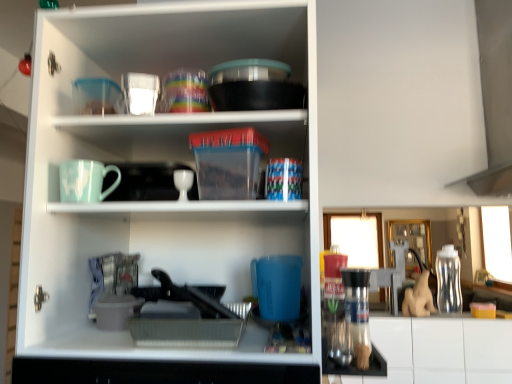
Question: From a real-world perspective, relative to translucent plastic cups at upper center, which appears as the 1th tableware when viewed from the top, is matte ceramic mug at upper left vertically above or below?

Choices:
 (A) below
 (B) above

Answer: (A)

Question: Visually, is matte ceramic mug at upper left positioned to the left or to the right of translucent plastic cups at upper center, the 3th tableware ordered from the bottom?

Choices:
 (A) left
 (B) right

Answer: (A)

Question: Which is nearer to the transparent plastic bottle at right?

Choices:
 (A) gray plastic tray at lower center
 (B) white glossy egg cup at center, which is the 3th tableware from top to bottom
 (C) transparent glass cup at upper center, acting as the 2th tableware starting from the top
 (D) translucent plastic cups at upper center, which appears as the 1th tableware when viewed from the top
 (E) matte ceramic mug at upper left

Answer: (A)

Question: Based on their relative distances, which object is farther from the transparent plastic bottle at right?

Choices:
 (A) matte ceramic mug at upper left
 (B) white glossy egg cup at center, arranged as the 1th tableware when ordered from the bottom
 (C) gray plastic tray at lower center
 (D) transparent glass cup at upper center, acting as the 2th tableware starting from the top
 (E) translucent plastic cups at upper center, which appears as the 1th tableware when viewed from the top

Answer: (A)